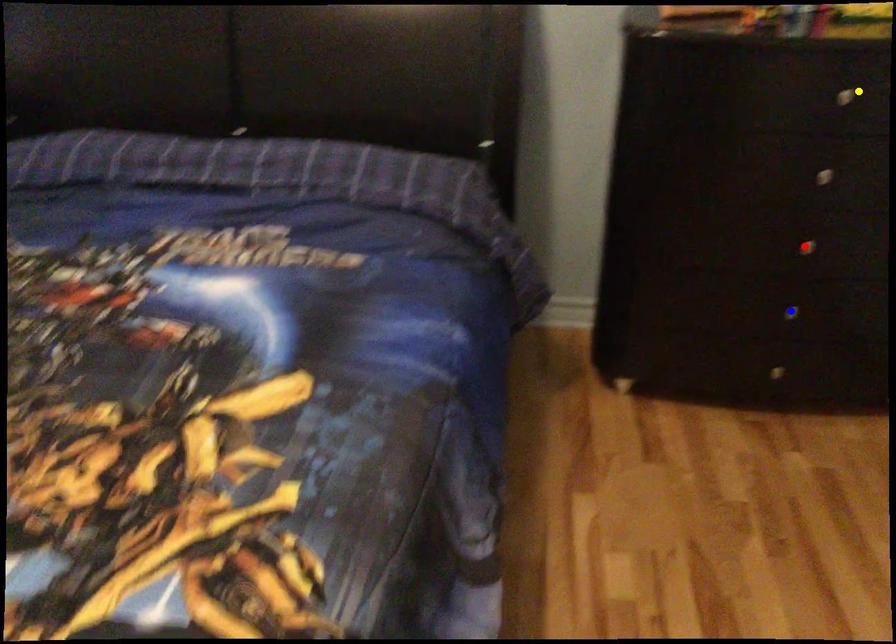
Order these from nearest to farthest:
blue point | red point | yellow point

1. yellow point
2. red point
3. blue point